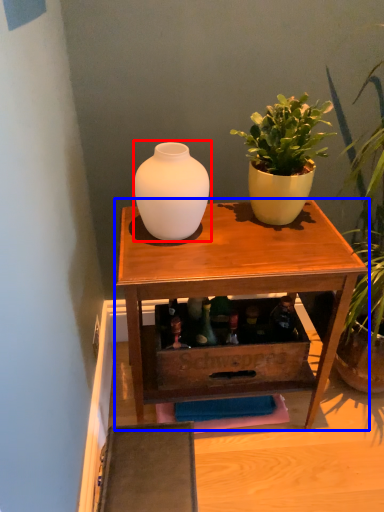
Question: Which object appears farthest to the camera in this image, vase (highlighted by a red box) or table (highlighted by a blue box)?

Choices:
 (A) vase
 (B) table

Answer: (B)